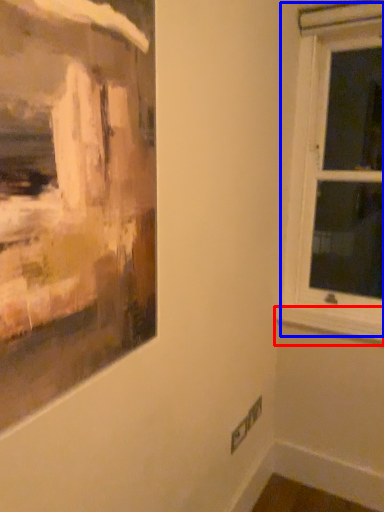
Question: Which object appears closest to the camera in this image, window sill (highlighted by a red box) or window (highlighted by a blue box)?

Choices:
 (A) window sill
 (B) window

Answer: (B)